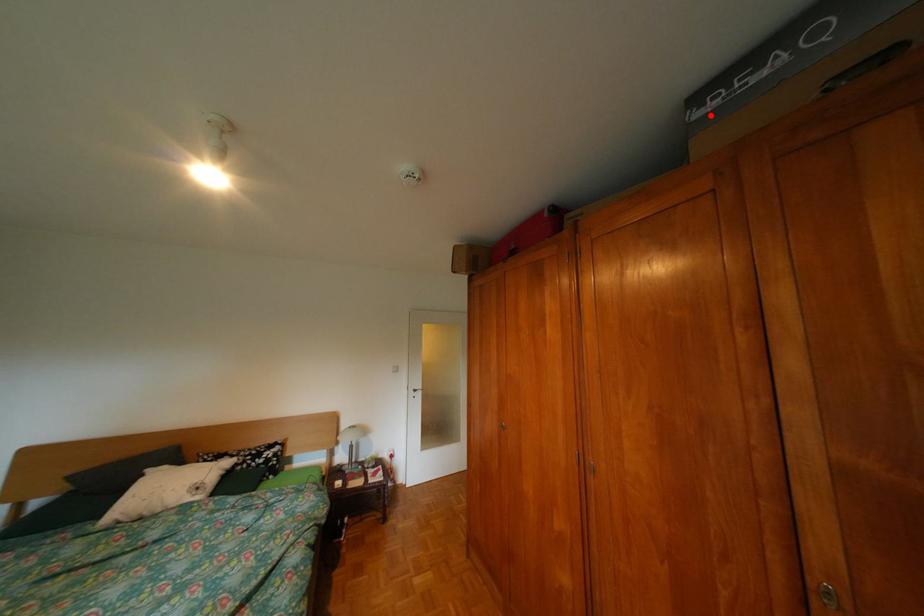
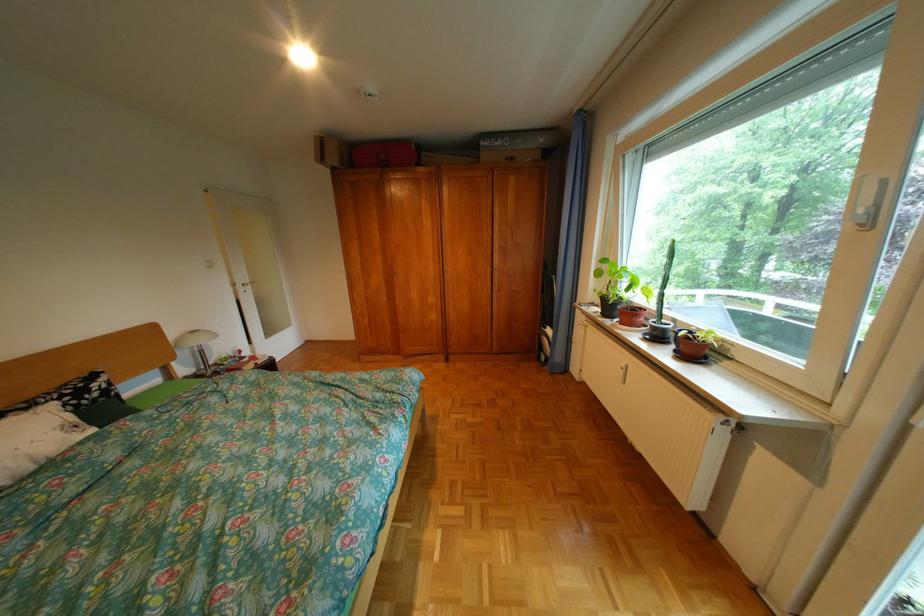
Question: A red point is marked in image1. In image2, is the corresponding 3D point closer to the camera or farther? Reply with the corresponding letter.

Choices:
 (A) The corresponding 3D point is closer.
 (B) The corresponding 3D point is farther.

Answer: (A)